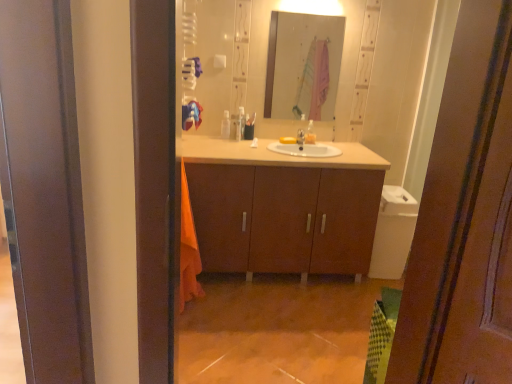
Locate an element on the screen. The width and height of the screenshot is (512, 384). vacant area that is in front of silver metallic tap at center is located at coordinates (300, 149).